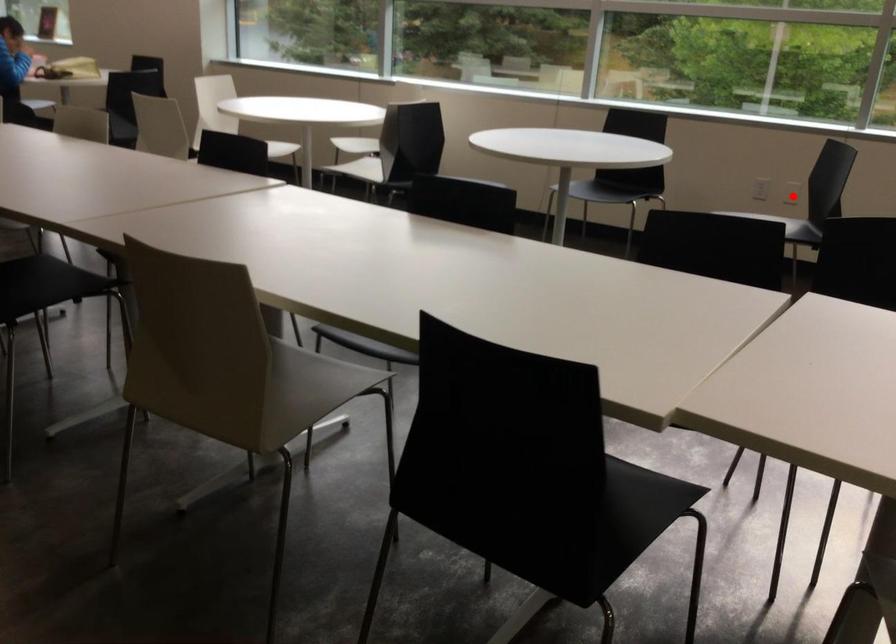
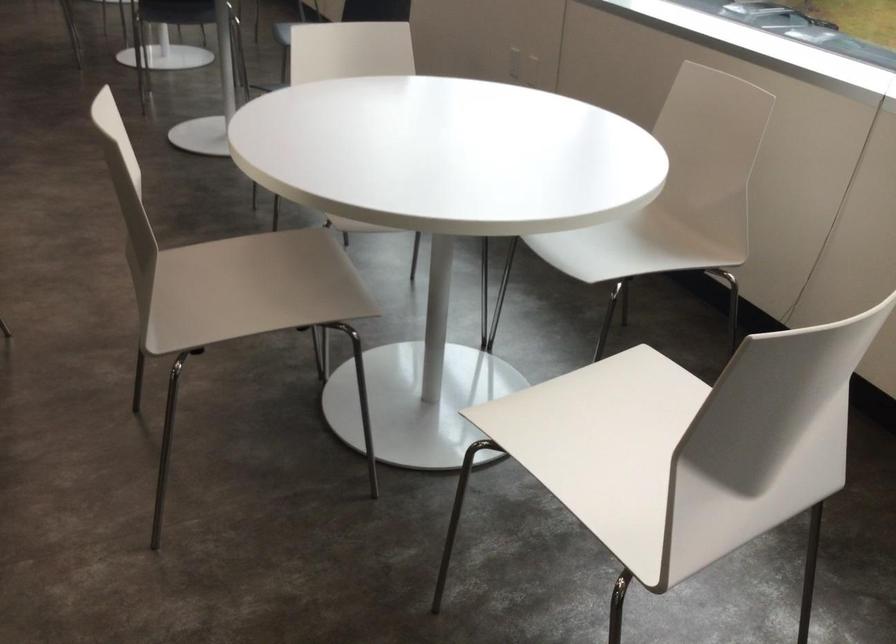
Question: I am providing you with two images of the same scene from different viewpoints. A red point is marked on the first image. At the location where the point appears in image 1, is it still visible in image 2?

Choices:
 (A) Yes
 (B) No

Answer: (B)